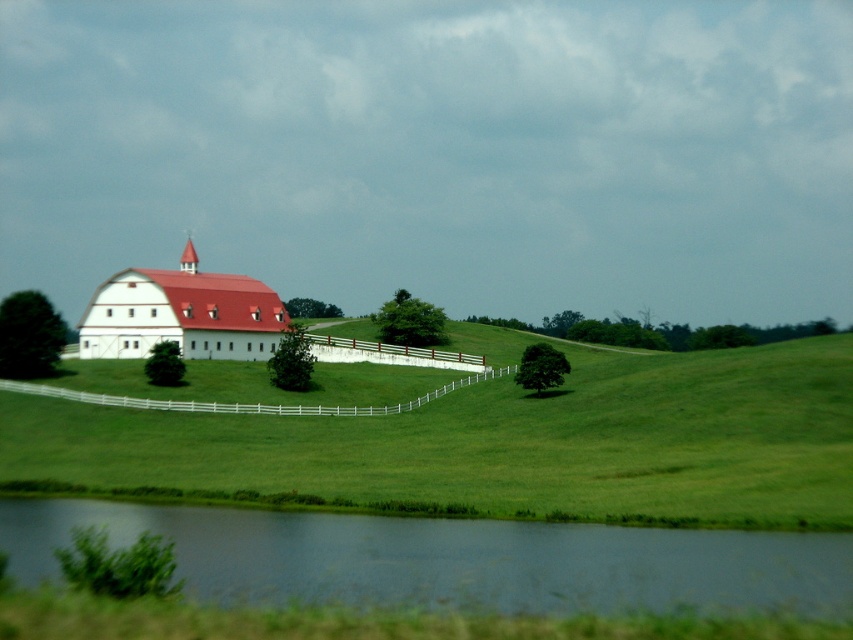
Question: Can you confirm if green grassy at center is positioned to the left of white wooden fence at center?

Choices:
 (A) yes
 (B) no

Answer: (B)

Question: Which point is farther from the camera taking this photo?

Choices:
 (A) (154, 403)
 (B) (213, 308)
 (C) (393, 577)
 (D) (706, 416)

Answer: (B)

Question: Which of the following is the farthest from the observer?

Choices:
 (A) green grassy at center
 (B) smooth reflective water at lower center
 (C) matte white barn at center

Answer: (C)

Question: Is green grassy at center wider than smooth reflective water at lower center?

Choices:
 (A) yes
 (B) no

Answer: (A)

Question: Which object appears closest to the camera in this image?

Choices:
 (A) smooth reflective water at lower center
 (B) green grassy at center
 (C) matte white barn at center

Answer: (A)

Question: Is green grassy at center to the right of matte white barn at center from the viewer's perspective?

Choices:
 (A) no
 (B) yes

Answer: (B)